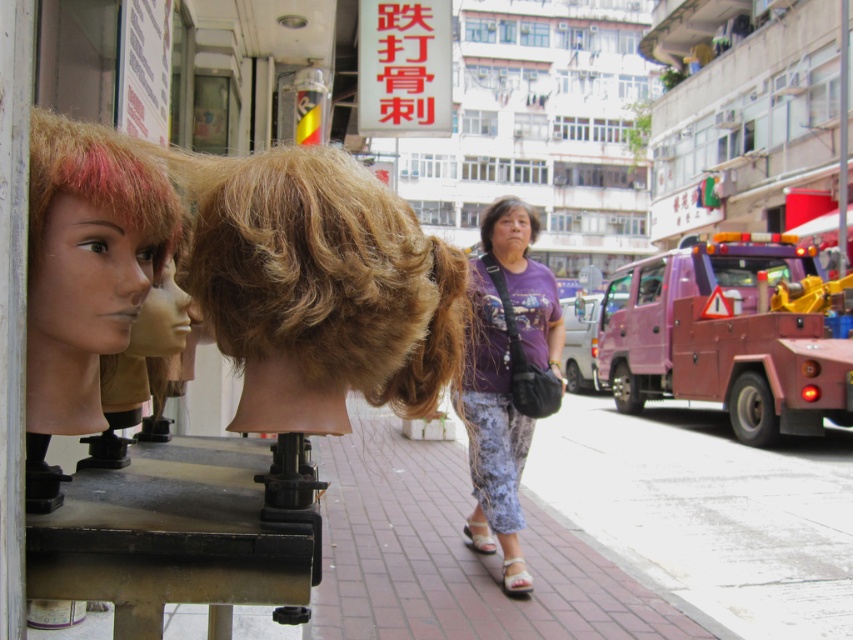
You are a customer looking at the wig display. You see a purple fabric shirt at center and a purple matte head at center. Which item is positioned to the left of the other?

The purple fabric shirt at center is to the left of the purple matte head at center.

You are a wig stylist trying to choose between the blonde synthetic wig at center and the purple matte head at center for a client who wants a thicker wig. Which wig should you recommend?

The purple matte head at center is thicker than the blonde synthetic wig at center, so you should recommend the purple matte head at center.

You are standing at the camera position and want to pick up the purple fabric shirt at center. Is it within your immediate reach?

The purple fabric shirt at center is 4.38 meters from camera, so it is not within immediate reach. You would need to move closer to reach it.